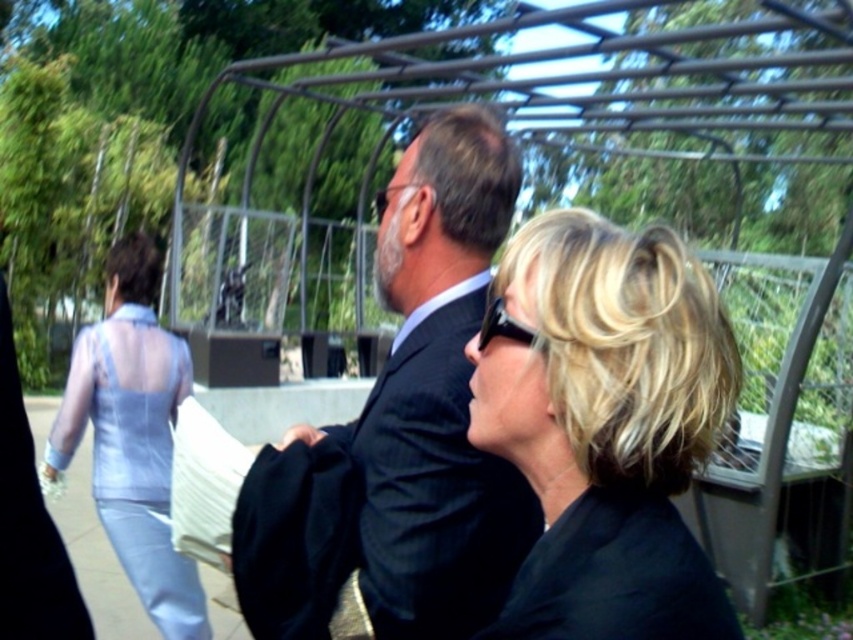
You are at a garden party and want to introduce yourself to two people sitting at the center. The people have blonde hair at center and dark gray suit at center. Which one should you approach first if you want to greet the person on the left side?

You should approach the dark gray suit at center first because the blonde hair at center is to the right of the dark gray suit at center, making the dark gray suit at center the leftmost person.

You are standing in the garden and want to walk towards the two points marked in the image. Which point, point (x=585, y=328) or point (x=134, y=252), will you reach first?

Point (x=585, y=328) is closer to the viewer than point (x=134, y=252), so you will reach point (x=585, y=328) first.